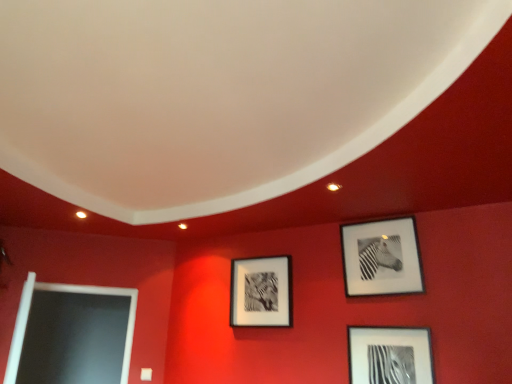
Question: Is metallic silver frame at lower right, which is the 2th picture frame in left-to-right order, taller than black matte picture frame at upper right, positioned as the first picture frame in right-to-left order?

Choices:
 (A) no
 (B) yes

Answer: (A)

Question: Can you confirm if metallic silver frame at lower right, which is the 2th picture frame in left-to-right order, is bigger than black matte picture frame at upper right, positioned as the first picture frame in right-to-left order?

Choices:
 (A) no
 (B) yes

Answer: (A)

Question: Is metallic silver frame at lower right, which is the second picture frame from right to left, positioned with its back to black matte picture frame at upper right, the 3th picture frame in the left-to-right sequence?

Choices:
 (A) no
 (B) yes

Answer: (A)

Question: Is the depth of metallic silver frame at lower right, which is the second picture frame from right to left, greater than that of black matte picture frame at upper right, the 3th picture frame in the left-to-right sequence?

Choices:
 (A) no
 (B) yes

Answer: (A)

Question: Is metallic silver frame at lower right, which is the second picture frame from right to left, surrounding black matte picture frame at upper right, positioned as the first picture frame in right-to-left order?

Choices:
 (A) yes
 (B) no

Answer: (B)

Question: From a real-world perspective, is matte black picture frame at center, the first picture frame viewed from the left, positioned above or below black matte picture frame at upper right, the 3th picture frame in the left-to-right sequence?

Choices:
 (A) below
 (B) above

Answer: (A)

Question: Would you say matte black picture frame at center, the first picture frame viewed from the left, is to the left or to the right of black matte picture frame at upper right, the 3th picture frame in the left-to-right sequence, in the picture?

Choices:
 (A) left
 (B) right

Answer: (A)

Question: Is matte black picture frame at center, the first picture frame viewed from the left, taller or shorter than black matte picture frame at upper right, the 3th picture frame in the left-to-right sequence?

Choices:
 (A) short
 (B) tall

Answer: (A)

Question: Is matte black picture frame at center, which is the 3th picture frame from right to left, inside or outside of black matte picture frame at upper right, positioned as the first picture frame in right-to-left order?

Choices:
 (A) outside
 (B) inside

Answer: (A)

Question: Looking at the image, does metallic silver frame at lower right, which is the second picture frame from right to left, seem bigger or smaller compared to matte black picture frame at center, which is the 3th picture frame from right to left?

Choices:
 (A) small
 (B) big

Answer: (A)

Question: In terms of width, does metallic silver frame at lower right, which is the second picture frame from right to left, look wider or thinner when compared to matte black picture frame at center, the first picture frame viewed from the left?

Choices:
 (A) thin
 (B) wide

Answer: (A)

Question: In the image, is metallic silver frame at lower right, which is the second picture frame from right to left, on the left side or the right side of matte black picture frame at center, the first picture frame viewed from the left?

Choices:
 (A) right
 (B) left

Answer: (A)

Question: Considering their positions, is metallic silver frame at lower right, which is the second picture frame from right to left, located in front of or behind matte black picture frame at center, which is the 3th picture frame from right to left?

Choices:
 (A) behind
 (B) front

Answer: (B)

Question: From the image's perspective, is metallic silver frame at lower right, which is the 2th picture frame in left-to-right order, located above or below black matte picture frame at upper right, positioned as the first picture frame in right-to-left order?

Choices:
 (A) below
 (B) above

Answer: (A)

Question: From a real-world perspective, is metallic silver frame at lower right, which is the 2th picture frame in left-to-right order, above or below black matte picture frame at upper right, the 3th picture frame in the left-to-right sequence?

Choices:
 (A) below
 (B) above

Answer: (A)